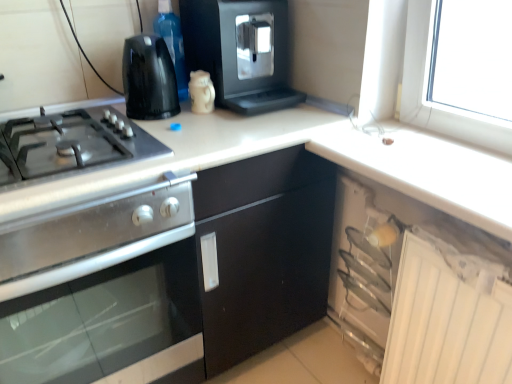
Question: Is white glossy mug at upper center, which ranks as the 2th kitchen appliance in bottom-to-top order, in contact with stainless steel oven at left, the 1th kitchen appliance positioned from the bottom?

Choices:
 (A) yes
 (B) no

Answer: (B)

Question: From the image's perspective, is white glossy mug at upper center, which ranks as the 2th kitchen appliance in bottom-to-top order, located above stainless steel oven at left, the fourth kitchen appliance from the top?

Choices:
 (A) yes
 (B) no

Answer: (A)

Question: Is white glossy mug at upper center, which ranks as the 2th kitchen appliance in bottom-to-top order, taller than stainless steel oven at left, the fourth kitchen appliance from the top?

Choices:
 (A) yes
 (B) no

Answer: (B)

Question: Considering the relative sizes of white glossy mug at upper center, the third kitchen appliance when ordered from top to bottom, and stainless steel oven at left, the 1th kitchen appliance positioned from the bottom, in the image provided, is white glossy mug at upper center, the third kitchen appliance when ordered from top to bottom, shorter than stainless steel oven at left, the 1th kitchen appliance positioned from the bottom,?

Choices:
 (A) yes
 (B) no

Answer: (A)

Question: Does white glossy mug at upper center, the third kitchen appliance when ordered from top to bottom, have a smaller size compared to stainless steel oven at left, the 1th kitchen appliance positioned from the bottom?

Choices:
 (A) yes
 (B) no

Answer: (A)

Question: Is stainless steel oven at left, the fourth kitchen appliance from the top, at the back of white glossy mug at upper center, the third kitchen appliance when ordered from top to bottom?

Choices:
 (A) no
 (B) yes

Answer: (A)

Question: Does satin silver gas stove at left have a greater height compared to transparent plastic bottle at upper center?

Choices:
 (A) yes
 (B) no

Answer: (B)

Question: Could you tell me if satin silver gas stove at left is facing transparent plastic bottle at upper center?

Choices:
 (A) yes
 (B) no

Answer: (B)

Question: From the image's perspective, is satin silver gas stove at left on transparent plastic bottle at upper center?

Choices:
 (A) no
 (B) yes

Answer: (A)

Question: Does satin silver gas stove at left come behind transparent plastic bottle at upper center?

Choices:
 (A) no
 (B) yes

Answer: (A)

Question: Considering the relative sizes of satin silver gas stove at left and transparent plastic bottle at upper center in the image provided, is satin silver gas stove at left shorter than transparent plastic bottle at upper center?

Choices:
 (A) no
 (B) yes

Answer: (B)

Question: Is satin silver gas stove at left positioned with its back to transparent plastic bottle at upper center?

Choices:
 (A) no
 (B) yes

Answer: (A)

Question: From a real-world perspective, does black plastic kettle at upper left, which is the third kitchen appliance in bottom-to-top order, sit lower than white plastic cabinet at lower right?

Choices:
 (A) no
 (B) yes

Answer: (A)